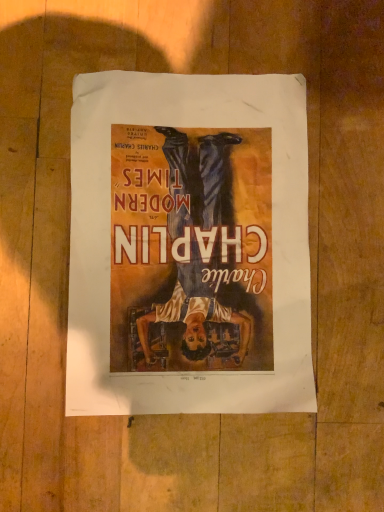
What is the approximate width of matte paper poster at center?

29.17 centimeters.

Measure the distance between matte paper poster at center and camera.

matte paper poster at center and camera are 13.80 inches apart from each other.

The image size is (384, 512). Describe the element at coordinates (189, 245) in the screenshot. I see `matte paper poster at center` at that location.

Identify the location of matte paper poster at center. The image size is (384, 512). (189, 245).

At what (x,y) coordinates should I click in order to perform the action: click on matte paper poster at center. Please return your answer as a coordinate pair (x, y). The image size is (384, 512). Looking at the image, I should click on (189, 245).